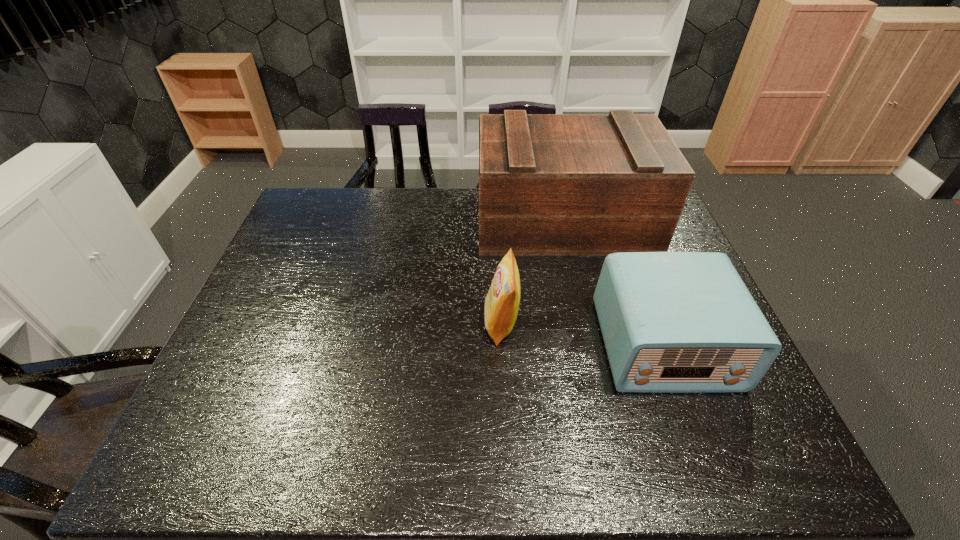
Locate an element on the screen. empty location between the crisp (potato chip) and the radio receiver is located at coordinates (583, 334).

This screenshot has width=960, height=540. Identify the location of free space between the radio receiver and the crisp (potato chip). pyautogui.click(x=583, y=334).

What are the coordinates of `free space between the crisp (potato chip) and the box` in the screenshot? It's located at (533, 272).

Where is `free space that is in between the crisp (potato chip) and the radio receiver`? free space that is in between the crisp (potato chip) and the radio receiver is located at coordinates (583, 334).

You are a GUI agent. You are given a task and a screenshot of the screen. Output one action in this format:
    pyautogui.click(x=<x>, y=<y>)
    Task: Click on the object identified as the closest to the crisp (potato chip)
    The image size is (960, 540).
    Given the screenshot: What is the action you would take?
    pyautogui.click(x=549, y=184)

Identify which object is the nearest to the crisp (potato chip). Please provide its 2D coordinates. Your answer should be formatted as a tuple, i.e. [(x, y)], where the tuple contains the x and y coordinates of a point satisfying the conditions above.

[(549, 184)]

The height and width of the screenshot is (540, 960). In order to click on vacant area in the image that satisfies the following two spatial constraints: 1. on the front side of the tallest object; 2. on the front-facing side of the crisp (potato chip) in this screenshot , I will do `click(588, 323)`.